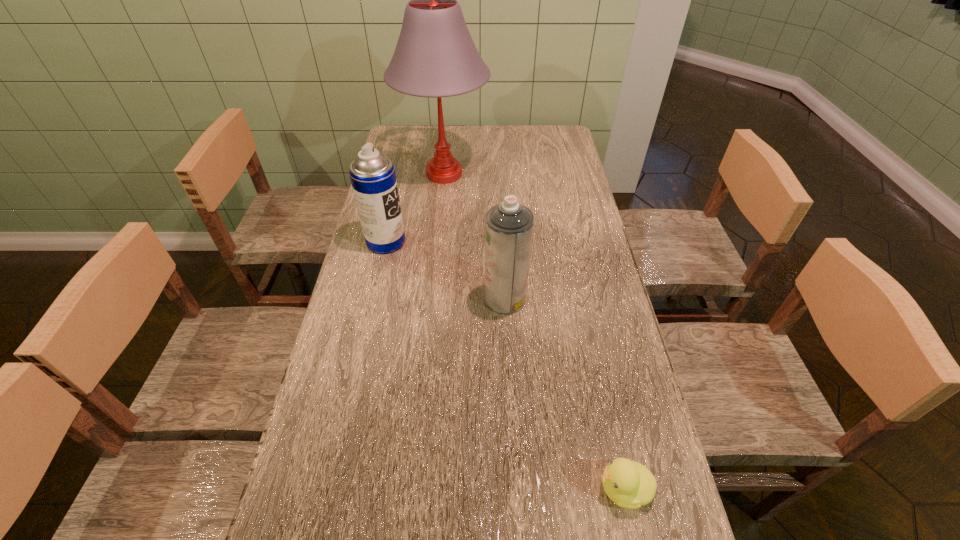
You are a GUI agent. You are given a task and a screenshot of the screen. Output one action in this format:
    pyautogui.click(x=<x>, y=<y>)
    Task: Click on the free space between the third farthest object and the duckling
    The width and height of the screenshot is (960, 540).
    Given the screenshot: What is the action you would take?
    pyautogui.click(x=564, y=393)

Find the location of a particular element. Image resolution: width=960 pixels, height=540 pixels. empty space that is in between the second nearest object and the third nearest object is located at coordinates (445, 270).

Where is `object that ranks as the second closest to the duckling`? Image resolution: width=960 pixels, height=540 pixels. object that ranks as the second closest to the duckling is located at coordinates (372, 174).

Locate an element on the screen. Image resolution: width=960 pixels, height=540 pixels. object identified as the third closest to the table lamp is located at coordinates (629, 484).

Where is `free region that satisfies the following two spatial constraints: 1. on the front-facing side of the farthest object; 2. on the label side of the second farthest object`? free region that satisfies the following two spatial constraints: 1. on the front-facing side of the farthest object; 2. on the label side of the second farthest object is located at coordinates coord(437,241).

The image size is (960, 540). What are the coordinates of `free spot that satisfies the following two spatial constraints: 1. on the front-facing side of the farthest object; 2. on the label side of the left aerosol can` in the screenshot? It's located at (437, 241).

Identify the location of vacant area that satisfies the following two spatial constraints: 1. on the label side of the third farthest object; 2. on the left side of the left aerosol can. (373, 298).

The width and height of the screenshot is (960, 540). Find the location of `vacant space that satisfies the following two spatial constraints: 1. on the front-facing side of the nearer aerosol can; 2. on the left side of the tallest object`. vacant space that satisfies the following two spatial constraints: 1. on the front-facing side of the nearer aerosol can; 2. on the left side of the tallest object is located at coordinates (431, 298).

Where is `vacant space that satisfies the following two spatial constraints: 1. on the front-facing side of the tallest object; 2. on the label side of the second farthest object`? This screenshot has height=540, width=960. vacant space that satisfies the following two spatial constraints: 1. on the front-facing side of the tallest object; 2. on the label side of the second farthest object is located at coordinates (437, 241).